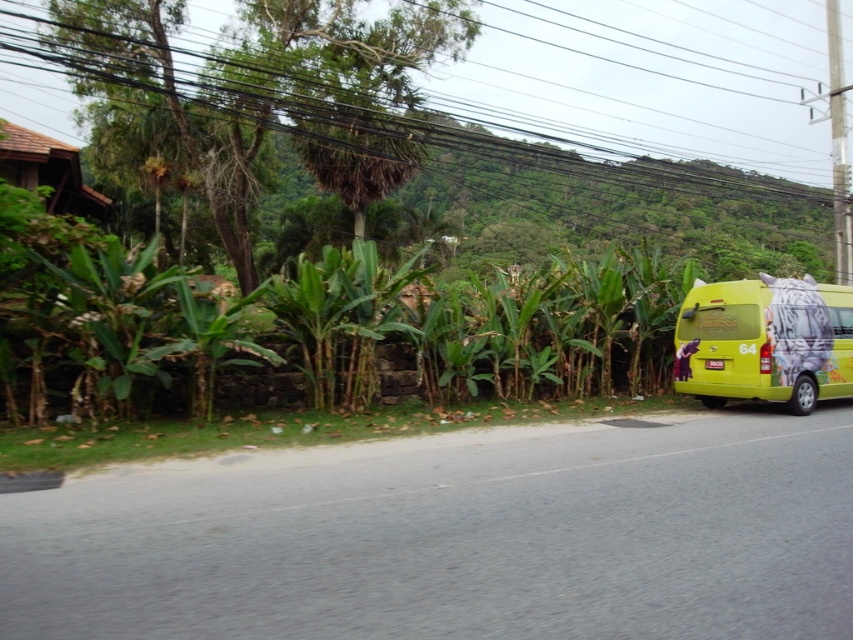
You are a delivery driver approaching the green leafy plants at center and the black wire at upper center along the road. Which object will you encounter first as you drive forward?

The green leafy plants at center will be encountered first because it is located below the black wire at upper center, meaning it is closer to the road level.

You are a delivery driver approaching the yellow matte van at right on the road. There are green leafy plants at center blocking your view. Can you see the road ahead clearly?

The green leafy plants at center are positioned on the left side of the yellow matte van at right, so they are not directly blocking the road ahead of the van. You should have a clear view of the road ahead.